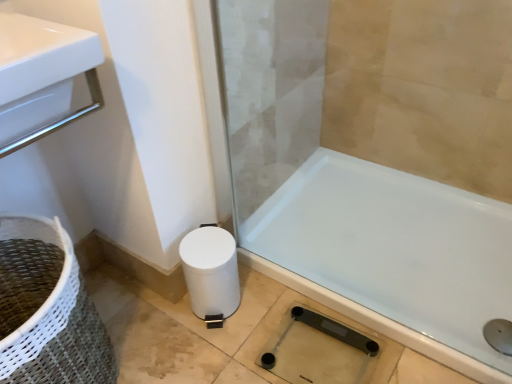
In order to face white matte toilet paper at lower left, should I rotate leftwards or rightwards?

It's best to rotate left around 5.687 degrees.

Identify the location of transparent glass shower at lower right. (318, 350).

Is point (221, 269) positioned before point (287, 177)?

That is True.

At what (x,y) coordinates should I click in order to perform the action: click on toilet paper below the transparent glass screen door at lower center (from the image's perspective). Please return your answer as a coordinate pair (x, y). This screenshot has width=512, height=384. Looking at the image, I should click on (211, 271).

Does white matte toilet paper at lower left have a lesser width compared to transparent glass screen door at lower center?

In fact, white matte toilet paper at lower left might be wider than transparent glass screen door at lower center.

Is white glossy bathtub at lower right situated inside white woven basket at lower left or outside?

white glossy bathtub at lower right is not inside white woven basket at lower left, it's outside.

Could you tell me if white glossy bathtub at lower right is turned towards white woven basket at lower left?

No, white glossy bathtub at lower right is not aimed at white woven basket at lower left.

Consider the image. From a real-world perspective, which is physically above, white glossy bathtub at lower right or white woven basket at lower left?

From a 3D spatial view, white woven basket at lower left is above.

Based on their sizes in the image, would you say white glossy bathtub at lower right is bigger or smaller than white woven basket at lower left?

Considering their sizes, white glossy bathtub at lower right takes up less space than white woven basket at lower left.

Is white woven basket at lower left situated inside white glossy bathtub at lower right or outside?

white woven basket at lower left is not enclosed by white glossy bathtub at lower right.

Between white woven basket at lower left and white glossy bathtub at lower right, which one has smaller width?

white woven basket at lower left is thinner.

Based on their sizes in the image, would you say white woven basket at lower left is bigger or smaller than white glossy bathtub at lower right?

Clearly, white woven basket at lower left is larger in size than white glossy bathtub at lower right.

Is white woven basket at lower left touching white glossy bathtub at lower right?

No, white woven basket at lower left is not beside white glossy bathtub at lower right.

Who is shorter, white glossy bathtub at lower right or white matte toilet paper at lower left?

white glossy bathtub at lower right.

Is white glossy bathtub at lower right to the left or to the right of white matte toilet paper at lower left in the image?

Clearly, white glossy bathtub at lower right is on the right of white matte toilet paper at lower left in the image.

Between point (360, 205) and point (217, 274), which one is positioned behind?

The point (360, 205) is behind.

From the image's perspective, does white glossy bathtub at lower right appear lower than white matte toilet paper at lower left?

Correct, white glossy bathtub at lower right appears lower than white matte toilet paper at lower left in the image.

Based on their sizes in the image, would you say transparent glass shower at lower right is bigger or smaller than white woven basket at lower left?

Clearly, transparent glass shower at lower right is smaller in size than white woven basket at lower left.

Considering the sizes of objects transparent glass shower at lower right and white woven basket at lower left in the image provided, who is wider, transparent glass shower at lower right or white woven basket at lower left?

With larger width is white woven basket at lower left.

In terms of height, does transparent glass shower at lower right look taller or shorter compared to white woven basket at lower left?

Clearly, transparent glass shower at lower right is shorter compared to white woven basket at lower left.

At what (x,y) coordinates should I click in order to perform the action: click on screen door on the left of white glossy bathtub at lower right. Please return your answer as a coordinate pair (x, y). This screenshot has height=384, width=512. Looking at the image, I should click on (269, 90).

Do you think white glossy bathtub at lower right is within transparent glass screen door at lower center, or outside of it?

white glossy bathtub at lower right is not enclosed by transparent glass screen door at lower center.

Is white glossy bathtub at lower right thinner than transparent glass screen door at lower center?

In fact, white glossy bathtub at lower right might be wider than transparent glass screen door at lower center.

From the picture: In the image, is white matte toilet paper at lower left positioned in front of or behind white woven basket at lower left?

In the image, white matte toilet paper at lower left appears behind white woven basket at lower left.

Can you confirm if white matte toilet paper at lower left is bigger than white woven basket at lower left?

No.

Is white woven basket at lower left surrounded by white matte toilet paper at lower left?

Actually, white woven basket at lower left is outside white matte toilet paper at lower left.

Image resolution: width=512 pixels, height=384 pixels. I want to click on screen door that is above the white matte toilet paper at lower left (from a real-world perspective), so click(269, 90).

Where is `basket container below the white glossy bathtub at lower right (from the image's perspective)`? The height and width of the screenshot is (384, 512). basket container below the white glossy bathtub at lower right (from the image's perspective) is located at coordinates 47,309.

Based on their spatial positions, is white matte toilet paper at lower left or white woven basket at lower left further from transparent glass screen door at lower center?

Among the two, white woven basket at lower left is located further to transparent glass screen door at lower center.

Estimate the real-world distances between objects in this image. Which object is closer to white woven basket at lower left, white glossy bathtub at lower right or transparent glass shower at lower right?

transparent glass shower at lower right is closer to white woven basket at lower left.

Looking at the image, which one is located further to transparent glass shower at lower right, transparent glass screen door at lower center or white woven basket at lower left?

transparent glass screen door at lower center is further to transparent glass shower at lower right.

Based on their spatial positions, is transparent glass shower at lower right or white matte toilet paper at lower left closer to white woven basket at lower left?

white matte toilet paper at lower left is positioned closer to the anchor white woven basket at lower left.

Which object lies further to the anchor point transparent glass shower at lower right, white woven basket at lower left or white glossy bathtub at lower right?

white woven basket at lower left is positioned further to the anchor transparent glass shower at lower right.

Based on their spatial positions, is white matte toilet paper at lower left or white glossy bathtub at lower right further from transparent glass screen door at lower center?

white matte toilet paper at lower left lies further to transparent glass screen door at lower center than the other object.

Looking at the image, which one is located further to white matte toilet paper at lower left, transparent glass shower at lower right or transparent glass screen door at lower center?

transparent glass screen door at lower center is positioned further to the anchor white matte toilet paper at lower left.

Estimate the real-world distances between objects in this image. Which object is closer to white glossy bathtub at lower right, transparent glass shower at lower right or white matte toilet paper at lower left?

The object closer to white glossy bathtub at lower right is transparent glass shower at lower right.

Identify the location of toilet paper between transparent glass screen door at lower center and white glossy bathtub at lower right in the up-down direction. Image resolution: width=512 pixels, height=384 pixels. (211, 271).

This screenshot has width=512, height=384. What are the coordinates of `basket container between transparent glass screen door at lower center and transparent glass shower at lower right vertically` in the screenshot? It's located at (47, 309).

Locate an element on the screen. toilet paper between transparent glass screen door at lower center and white woven basket at lower left vertically is located at coordinates (211, 271).

Image resolution: width=512 pixels, height=384 pixels. Identify the location of bathtub that lies between transparent glass screen door at lower center and transparent glass shower at lower right from top to bottom. click(392, 256).